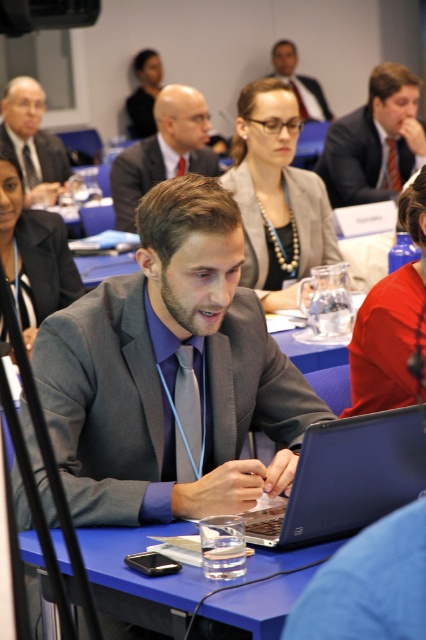
Question: Is matte black blazer at center to the left of matte black tie at left from the viewer's perspective?

Choices:
 (A) yes
 (B) no

Answer: (B)

Question: Which of the following is the farthest from the observer?

Choices:
 (A) matte gray suit at upper right
 (B) blue plastic table at center
 (C) blue silk tie at center

Answer: (A)

Question: From the image, what is the correct spatial relationship of blue plastic table at center in relation to matte black suit at center?

Choices:
 (A) left
 (B) right

Answer: (A)

Question: Which object appears farthest from the camera in this image?

Choices:
 (A) blue plastic table at center
 (B) matte black laptop at center

Answer: (B)

Question: Which object appears farthest from the camera in this image?

Choices:
 (A) matte black tie at left
 (B) matte red shirt at right

Answer: (A)

Question: Can you confirm if matte black laptop at center is smaller than gray suit at center?

Choices:
 (A) yes
 (B) no

Answer: (A)